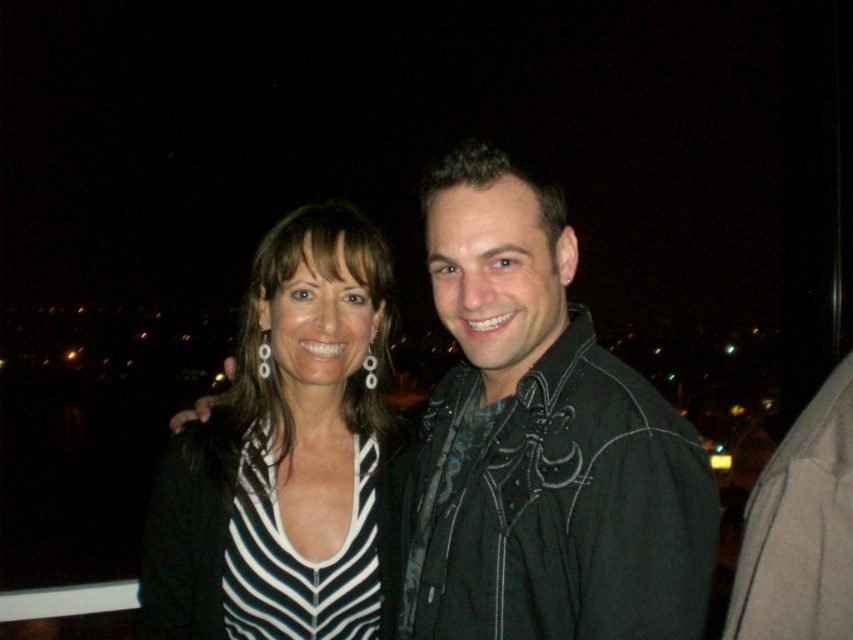
Who is positioned more to the left, black leather jacket at center or striped fabric top at center?

striped fabric top at center

Does black leather jacket at center have a smaller size compared to striped fabric top at center?

Incorrect, black leather jacket at center is not smaller in size than striped fabric top at center.

Is point (553, 566) less distant than point (289, 339)?

Yes, it is in front of point (289, 339).

Locate an element on the screen. black leather jacket at center is located at coordinates tap(543, 442).